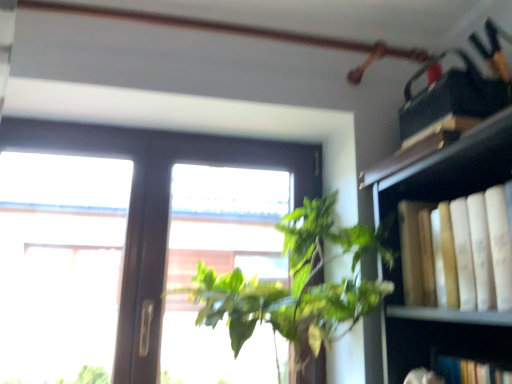
At what (x,y) coordinates should I click in order to perform the action: click on transparent glass window at center. Please return your answer as a coordinate pair (x, y). Looking at the image, I should click on (158, 203).

Is green leafy plant at center thinner than yellow paper book at right?

Incorrect, the width of green leafy plant at center is not less than that of yellow paper book at right.

Considering the relative positions of green leafy plant at center and yellow paper book at right in the image provided, is green leafy plant at center to the left or to the right of yellow paper book at right?

Based on their positions, green leafy plant at center is located to the left of yellow paper book at right.

Does green leafy plant at center turn towards yellow paper book at right?

No, green leafy plant at center does not turn towards yellow paper book at right.

From the image's perspective, is green leafy plant at center under yellow paper book at right?

Correct, green leafy plant at center appears lower than yellow paper book at right in the image.

From the image's perspective, which is below, green leafy plant at center or transparent glass window at center?

green leafy plant at center is shown below in the image.

Which of these two, green leafy plant at center or transparent glass window at center, stands shorter?

green leafy plant at center is shorter.

Which object is thinner, green leafy plant at center or transparent glass window at center?

Thinner between the two is transparent glass window at center.

Are green leafy plant at center and transparent glass window at center beside each other?

green leafy plant at center and transparent glass window at center are clearly separated.

Is transparent glass window at center not inside green leafy plant at center?

Yes, transparent glass window at center is located beyond the bounds of green leafy plant at center.

Is transparent glass window at center at the right side of green leafy plant at center?

No, transparent glass window at center is not to the right of green leafy plant at center.

From the picture: Can you confirm if transparent glass window at center is smaller than green leafy plant at center?

Yes, transparent glass window at center is smaller than green leafy plant at center.

Can yellow paper book at right be found inside transparent glass window at center?

No.

Based on the photo, does transparent glass window at center have a larger size compared to yellow paper book at right?

Yes, transparent glass window at center is bigger than yellow paper book at right.

Is there a large distance between transparent glass window at center and yellow paper book at right?

transparent glass window at center is near yellow paper book at right, not far away.

Is yellow paper book at right in front of green leafy plant at center?

Yes, yellow paper book at right is closer to the camera.

I want to click on houseplant below the yellow paper book at right (from a real-world perspective), so click(x=297, y=284).

From the image's perspective, who appears lower, yellow paper book at right or green leafy plant at center?

From the image's view, green leafy plant at center is below.

From a real-world perspective, which object stands above the other?

From a 3D spatial view, yellow paper book at right is above.

Visually, is yellow paper book at right positioned to the left or to the right of transparent glass window at center?

In the image, yellow paper book at right appears on the right side of transparent glass window at center.

Is the position of yellow paper book at right more distant than that of transparent glass window at center?

No.

Is yellow paper book at right in contact with transparent glass window at center?

No, yellow paper book at right is not with transparent glass window at center.

Between yellow paper book at right and transparent glass window at center, which one has smaller size?

yellow paper book at right.

Find the location of a particular element. houseplant behind the yellow paper book at right is located at coordinates (297, 284).

Identify the location of houseplant below the transparent glass window at center (from the image's perspective). (297, 284).

In the scene shown: Based on their spatial positions, is green leafy plant at center or transparent glass window at center further from yellow paper book at right?

transparent glass window at center.

Estimate the real-world distances between objects in this image. Which object is closer to green leafy plant at center, yellow paper book at right or transparent glass window at center?

yellow paper book at right lies closer to green leafy plant at center than the other object.

Considering their positions, is transparent glass window at center positioned closer to yellow paper book at right than green leafy plant at center?

green leafy plant at center is positioned closer to the anchor yellow paper book at right.

From the image, which object appears to be nearer to green leafy plant at center, transparent glass window at center or yellow paper book at right?

yellow paper book at right is closer to green leafy plant at center.

Based on their spatial positions, is green leafy plant at center or yellow paper book at right further from transparent glass window at center?

yellow paper book at right lies further to transparent glass window at center than the other object.

Based on their spatial positions, is yellow paper book at right or green leafy plant at center closer to transparent glass window at center?

green leafy plant at center.

Where is `houseplant between transparent glass window at center and yellow paper book at right from left to right`? The width and height of the screenshot is (512, 384). houseplant between transparent glass window at center and yellow paper book at right from left to right is located at coordinates (297, 284).